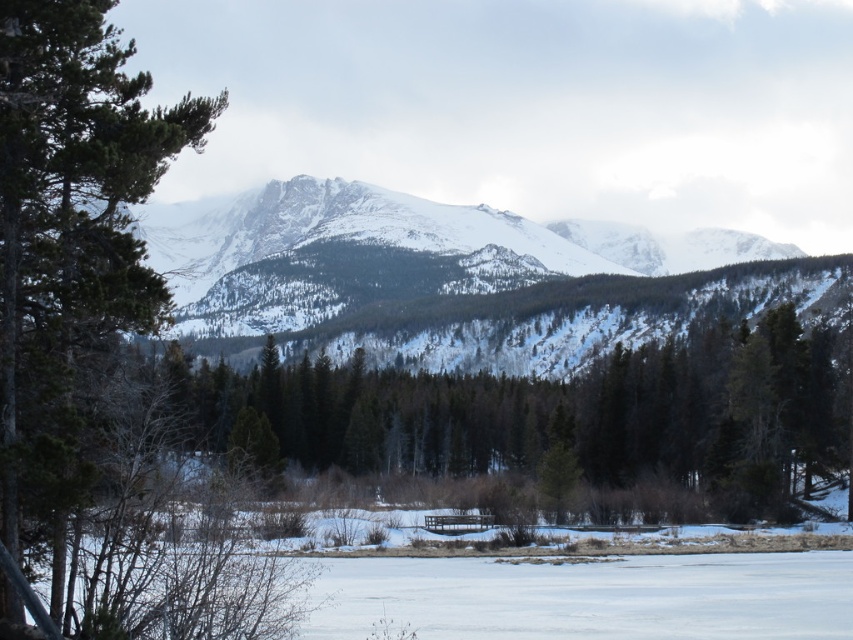
You are standing in the winter forest and see the green matte tree at center and the green textured pine tree at left. Which tree is closer to the path that runs along the left side of the forest?

The green textured pine tree at left is closer to the path that runs along the left side of the forest because it is positioned to the left of the green matte tree at center.

You are standing in the winter landscape and want to take a photo. You notice two points in the scene labeled as point (27, 458) and point (178, 248). Which point is closer to your camera lens?

Point (27, 458) is closer to the camera lens than point (178, 248).

You are an outdoor enthusiast planning to set up a tent in this winter landscape. You notice the green matte tree at center and the green textured pine tree at left. Which tree would provide better shelter from the wind if placed between your tent and the wind direction?

The green textured pine tree at left would provide better shelter from the wind because the green matte tree at center is positioned under it, meaning the pine tree is taller and can block the wind more effectively.